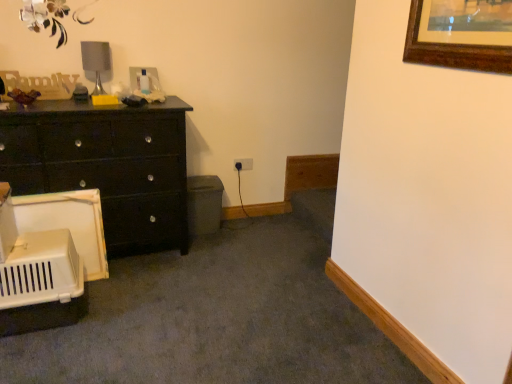
Question: Can you confirm if matte silver table lamp at upper left is taller than matte black dresser at left?

Choices:
 (A) yes
 (B) no

Answer: (B)

Question: Does matte silver table lamp at upper left have a greater width compared to matte black dresser at left?

Choices:
 (A) yes
 (B) no

Answer: (B)

Question: Considering the relative sizes of matte silver table lamp at upper left and matte black dresser at left in the image provided, is matte silver table lamp at upper left shorter than matte black dresser at left?

Choices:
 (A) yes
 (B) no

Answer: (A)

Question: Is matte silver table lamp at upper left at the right side of matte black dresser at left?

Choices:
 (A) yes
 (B) no

Answer: (A)

Question: Is the position of matte silver table lamp at upper left less distant than that of matte black dresser at left?

Choices:
 (A) yes
 (B) no

Answer: (B)

Question: Can you confirm if matte silver table lamp at upper left is smaller than matte black dresser at left?

Choices:
 (A) no
 (B) yes

Answer: (B)

Question: Is matte black dresser at left at the left side of matte silver table lamp at upper left?

Choices:
 (A) yes
 (B) no

Answer: (A)

Question: Is matte black dresser at left outside of matte silver table lamp at upper left?

Choices:
 (A) no
 (B) yes

Answer: (B)

Question: Does matte black dresser at left turn towards matte silver table lamp at upper left?

Choices:
 (A) no
 (B) yes

Answer: (A)

Question: Is matte black dresser at left shorter than matte silver table lamp at upper left?

Choices:
 (A) yes
 (B) no

Answer: (B)

Question: Considering the relative positions of matte black dresser at left and matte silver table lamp at upper left in the image provided, is matte black dresser at left to the right of matte silver table lamp at upper left from the viewer's perspective?

Choices:
 (A) yes
 (B) no

Answer: (B)

Question: Is matte black dresser at left looking in the opposite direction of matte silver table lamp at upper left?

Choices:
 (A) yes
 (B) no

Answer: (B)

Question: Does point [87, 64] appear closer or farther from the camera than point [145, 243]?

Choices:
 (A) farther
 (B) closer

Answer: (B)